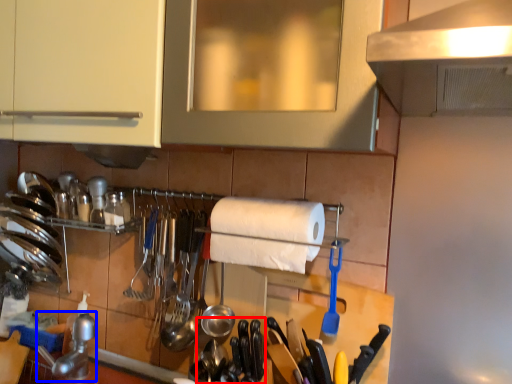
Question: Among these objects, which one is farthest to the camera, silverware (highlighted by a red box) or stainless steel (highlighted by a blue box)?

Choices:
 (A) silverware
 (B) stainless steel

Answer: (B)